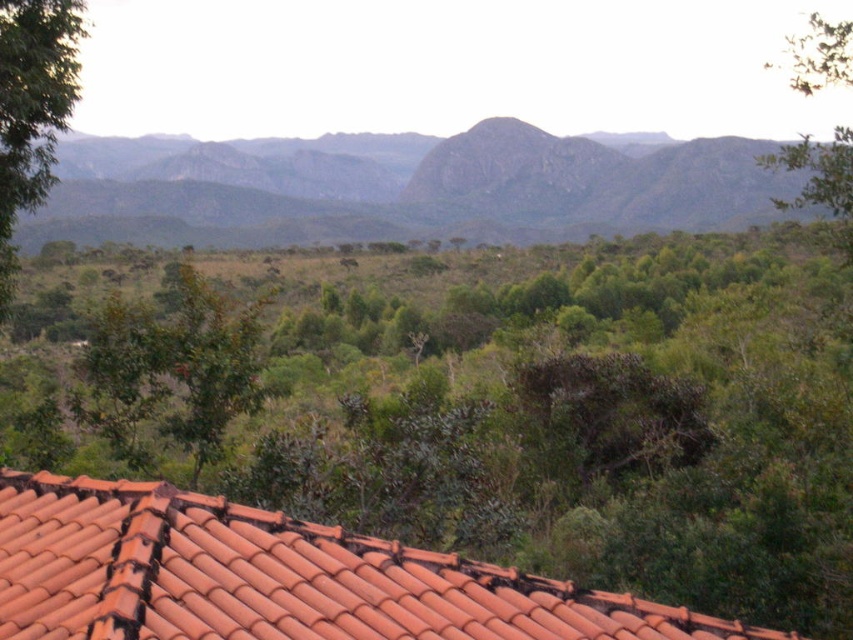
In the scene shown: Based on the scene description, where exactly is the terracotta tiles at lower center located in terms of coordinates?

The terracotta tiles at lower center are located at coordinates point (273, 577).

You are standing in the scenic landscape and want to take a photo of the rugged granite mountain at center. However, there are terracotta tiles at lower center blocking your view. Can you move to your left or right to avoid the obstruction?

The terracotta tiles at lower center is to the right of rugged granite mountain at center. Therefore, moving to your left would allow you to avoid the obstruction caused by the terracotta tiles at lower center and get a clear view of the rugged granite mountain at center.